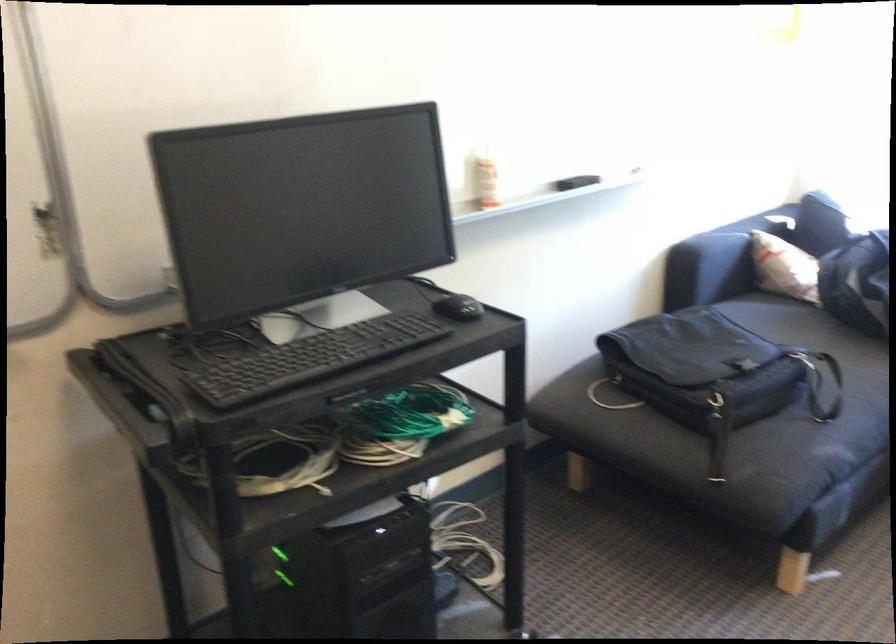
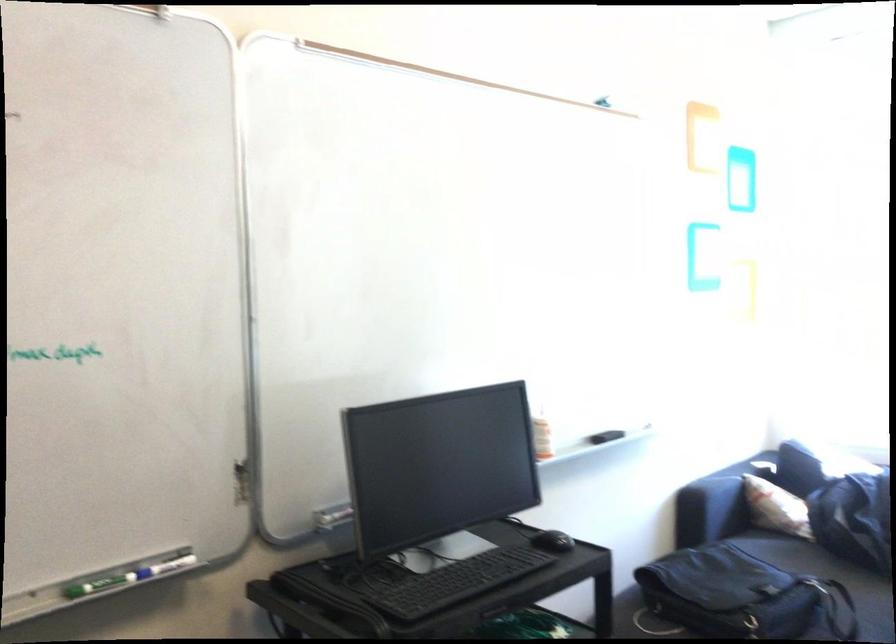
Find the pixel in the second image that matches (484,178) in the first image.

(540, 431)